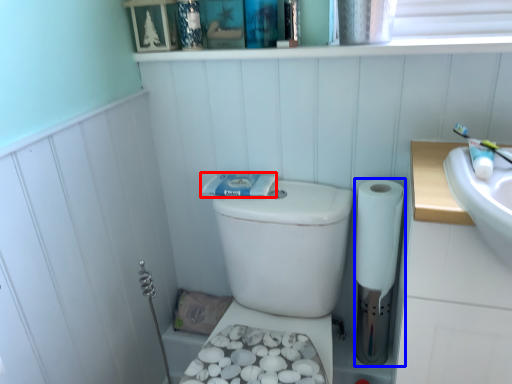
Question: Which object is further to the camera taking this photo, toothpaste (highlighted by a red box) or toilet paper (highlighted by a blue box)?

Choices:
 (A) toothpaste
 (B) toilet paper

Answer: (A)